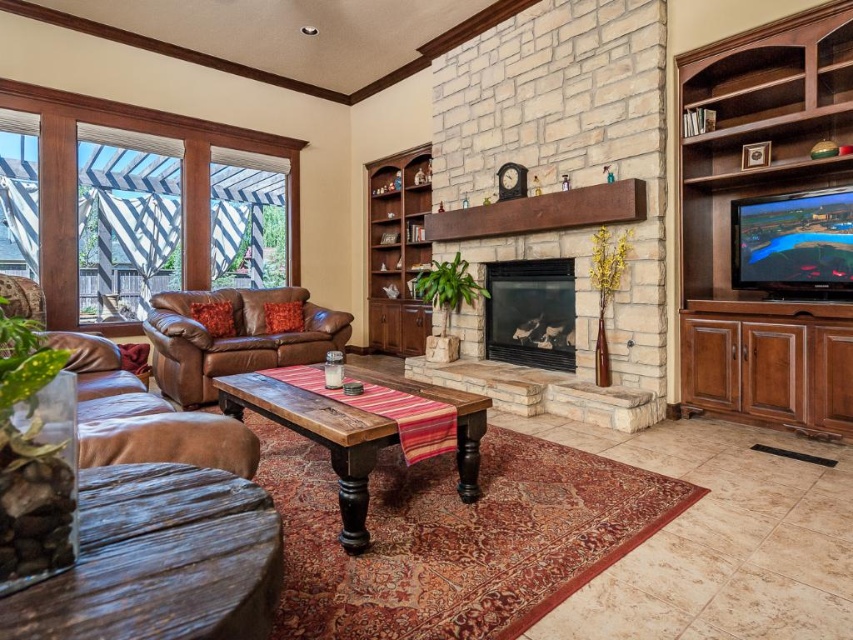
Question: Among these points, which one is nearest to the camera?

Choices:
 (A) (698, 212)
 (B) (495, 342)
 (C) (244, 307)

Answer: (A)

Question: Which object is the farthest from the mahogany wood entertainment center at right?

Choices:
 (A) brown leather armchair at left
 (B) black glass fireplace at center
 (C) brown wood bookshelf at center

Answer: (C)

Question: Which point is farther to the camera?

Choices:
 (A) black glass fireplace at center
 (B) brown leather armchair at left
 (C) mahogany wood entertainment center at right

Answer: (A)

Question: Is brown wood bookshelf at center to the right of black glass fireplace at center from the viewer's perspective?

Choices:
 (A) yes
 (B) no

Answer: (B)

Question: Does brown wood bookshelf at center appear on the right side of black glass fireplace at center?

Choices:
 (A) no
 (B) yes

Answer: (A)

Question: Is brown leather couch at lower left closer to camera compared to black glass fireplace at center?

Choices:
 (A) no
 (B) yes

Answer: (B)